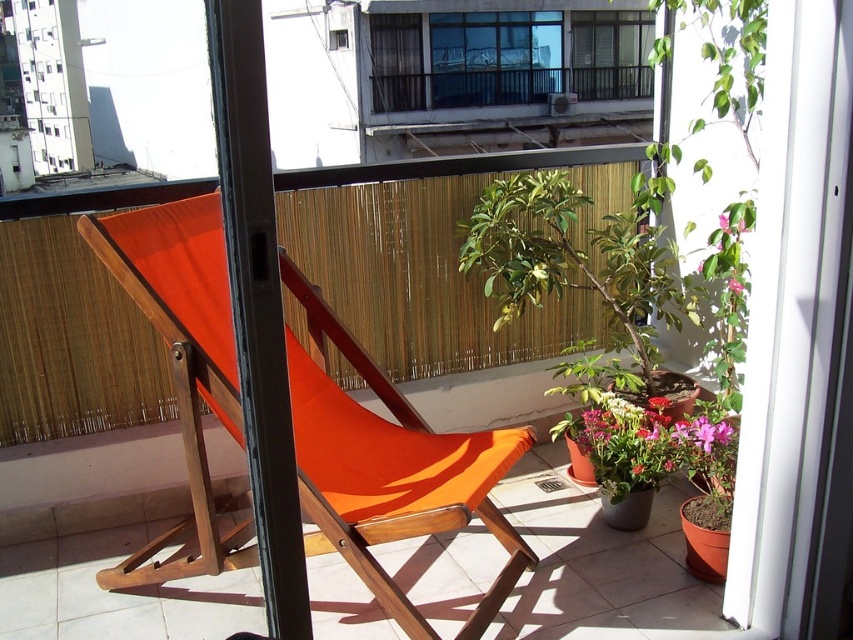
Question: Which point is farther from the camera taking this photo?

Choices:
 (A) (587, 93)
 (B) (500, 76)

Answer: (A)

Question: Is transparent glass window at upper center in front of clear glass window at upper center?

Choices:
 (A) no
 (B) yes

Answer: (B)

Question: Is transparent glass window at upper center to the left of clear glass window at upper center from the viewer's perspective?

Choices:
 (A) yes
 (B) no

Answer: (A)

Question: Which point is closer to the camera?

Choices:
 (A) (456, 51)
 (B) (619, 58)

Answer: (A)

Question: Does transparent glass window at upper center appear on the right side of clear glass window at upper center?

Choices:
 (A) yes
 (B) no

Answer: (B)